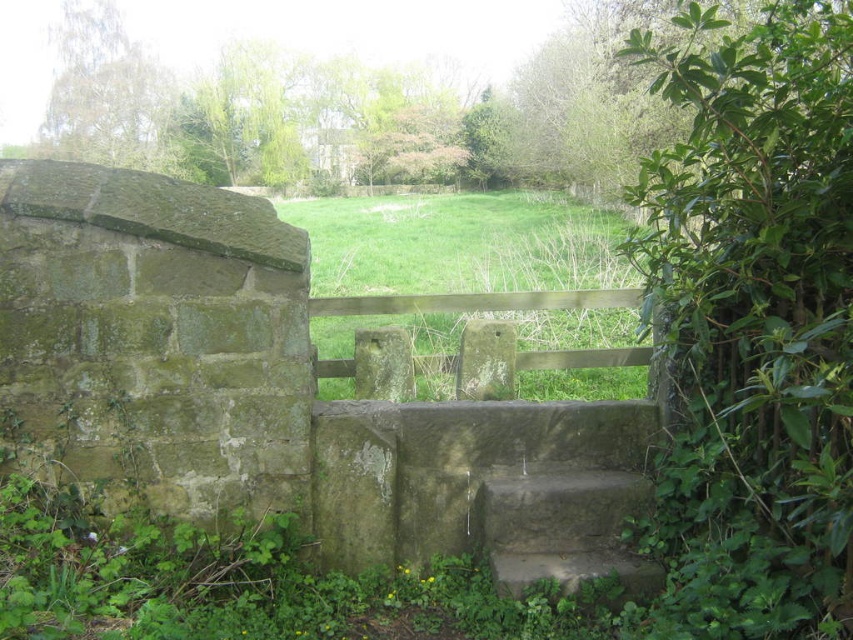
You are a gardener trying to mow the green grass at center. The brown wooden rail at center is in the way. Can you mow the grass without moving the rail?

The green grass at center might be wider than brown wooden rail at center, so there is a possibility that the grass area extends beyond the rail, allowing mowing without moving it. However, since the exact width difference isn not specified, it requires checking the actual space between them.